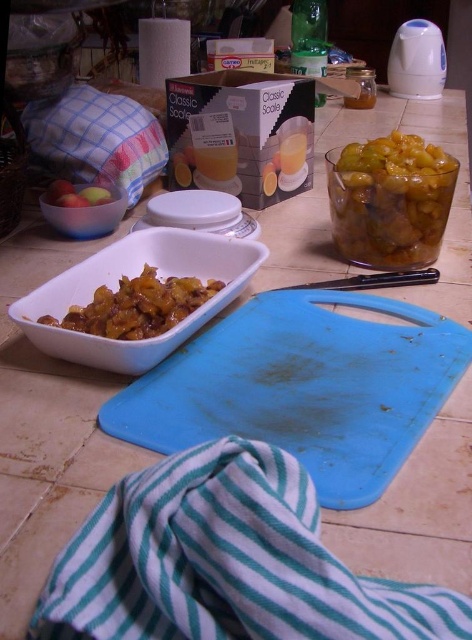
You are a chef standing in front of the kitchen countertop. You need to reach the translucent glass jar at upper right to get some spices. Considering your arm can extend 20 inches, can you comfortably reach it without moving your body?

The translucent glass jar at upper right is 21.08 inches away from the viewer. Since your arm can only extend 20 inches, you cannot comfortably reach it without moving your body.